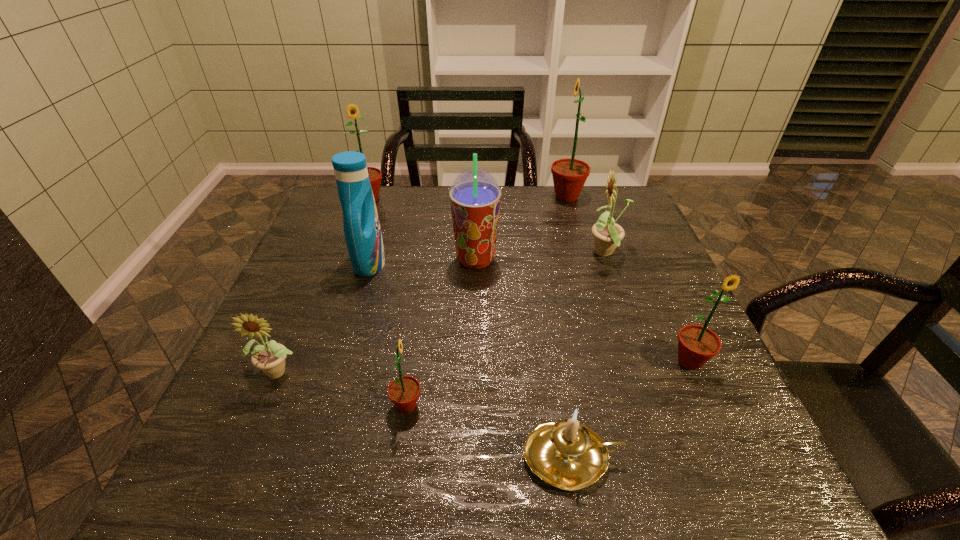
Where is `detergent at the left edge`? The width and height of the screenshot is (960, 540). detergent at the left edge is located at coordinates (362, 231).

At what (x,y) coordinates should I click in order to perform the action: click on object situated at the far left corner. Please return your answer as a coordinate pair (x, y). Looking at the image, I should click on (352, 111).

Locate an element on the screen. The width and height of the screenshot is (960, 540). object at the far right corner is located at coordinates (569, 175).

The height and width of the screenshot is (540, 960). In the image, there is a desktop. Find the location of `free space at the far edge`. free space at the far edge is located at coordinates (540, 216).

You are a GUI agent. You are given a task and a screenshot of the screen. Output one action in this format:
    pyautogui.click(x=<x>, y=<y>)
    Task: Click on the vacant space at the left edge
    This screenshot has height=540, width=960.
    Given the screenshot: What is the action you would take?
    pyautogui.click(x=287, y=389)

I want to click on vacant space at the right edge of the desktop, so click(x=632, y=242).

Locate an element on the screen. vacant space that is in between the fifth object from left to right and the third green sunflower from left to right is located at coordinates (521, 228).

Where is `vacant area that lies between the detergent and the second green sunflower from left to right`? vacant area that lies between the detergent and the second green sunflower from left to right is located at coordinates (388, 334).

This screenshot has height=540, width=960. I want to click on free spot between the nearest object and the detergent, so click(470, 360).

Where is `free spot between the nearer yellow sunflower and the second green sunflower from right to left`? The image size is (960, 540). free spot between the nearer yellow sunflower and the second green sunflower from right to left is located at coordinates (423, 284).